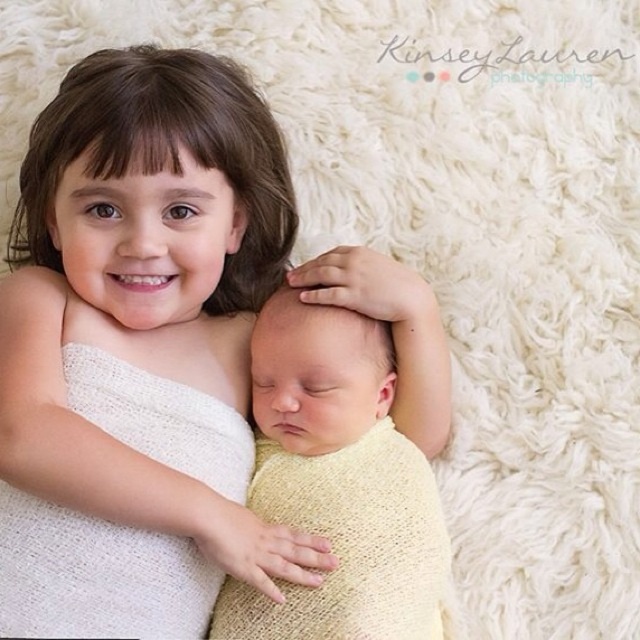
What do you see at coordinates (160, 349) in the screenshot? I see `white knitted fabric at upper left` at bounding box center [160, 349].

Is white knitted fabric at upper left behind yellow knitted fabric at center?

No, it is not.

Between point (243, 186) and point (353, 460), which one is positioned in front?

Point (353, 460)

The image size is (640, 640). What are the coordinates of `white knitted fabric at upper left` in the screenshot? It's located at (160, 349).